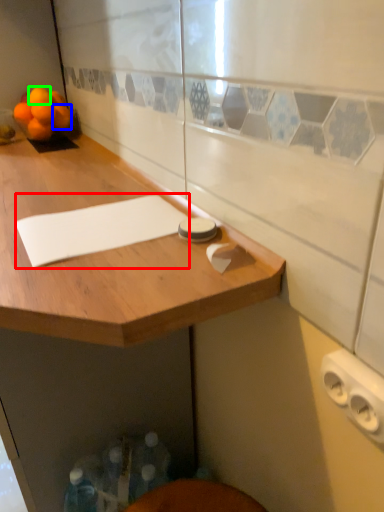
Question: Which object is positioned closest to notepad (highlighted by a red box)? Select from tangerine (highlighted by a blue box) and orange (highlighted by a green box).

Choices:
 (A) tangerine
 (B) orange

Answer: (A)